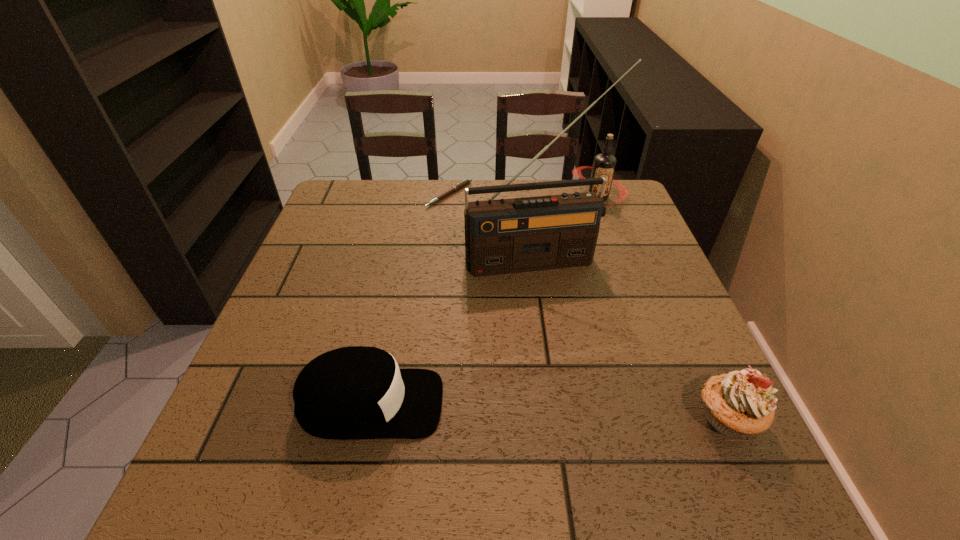
You are a GUI agent. You are given a task and a screenshot of the screen. Output one action in this format:
    pyautogui.click(x=<x>, y=<y>)
    Task: Click on the cap
    Image resolution: width=960 pixels, height=540 pixels.
    Given the screenshot: What is the action you would take?
    pyautogui.click(x=357, y=392)

Find the location of a particular element. The image size is (960, 540). cupcake is located at coordinates (740, 403).

Locate an element on the screen. This screenshot has height=540, width=960. radio receiver is located at coordinates (505, 236).

The width and height of the screenshot is (960, 540). I want to click on the third farthest object, so click(x=505, y=236).

At what (x,y) coordinates should I click in order to perform the action: click on the shortest object. Please return your answer as a coordinate pair (x, y). Looking at the image, I should click on (458, 186).

Find the location of a particular element. the second tallest object is located at coordinates (604, 164).

At what (x,y) coordinates should I click in order to perform the action: click on free space located on the front-facing side of the cap. Please return your answer as a coordinate pair (x, y). This screenshot has height=540, width=960. Looking at the image, I should click on (497, 404).

The height and width of the screenshot is (540, 960). In order to click on vacant region located 0.230m on the left of the cupcake in this screenshot , I will do `click(565, 417)`.

Where is `free point located on the front-facing side of the radio receiver`? The width and height of the screenshot is (960, 540). free point located on the front-facing side of the radio receiver is located at coordinates (561, 306).

This screenshot has width=960, height=540. I want to click on free space located 0.360m on the front-facing side of the radio receiver, so click(x=601, y=408).